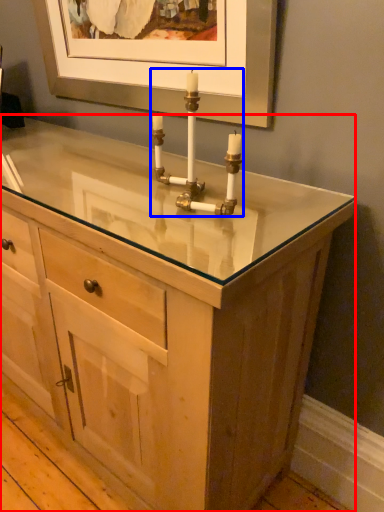
Question: Which of the following is the closest to the observer, chest of drawers (highlighted by a red box) or candle holder (highlighted by a blue box)?

Choices:
 (A) chest of drawers
 (B) candle holder

Answer: (A)